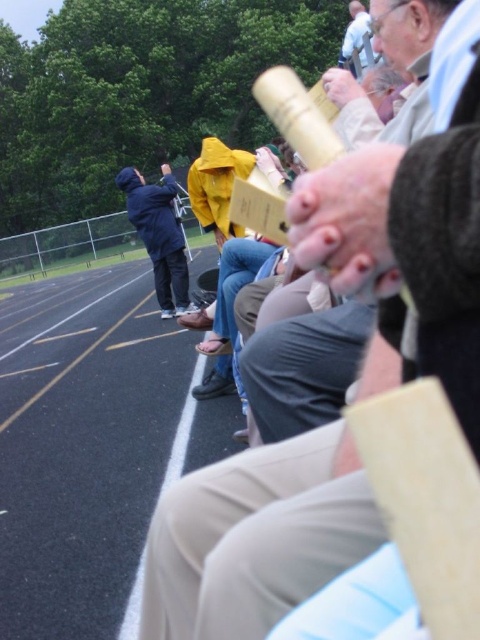
Does point (357, 237) come farther from viewer compared to point (181, 240)?

No, (357, 237) is closer to viewer.

Consider the image. Does yellow matte raincoat at center have a lesser height compared to blue matte jacket at center?

No.

Does point (207, 564) come farther from viewer compared to point (182, 291)?

No, it is not.

This screenshot has height=640, width=480. I want to click on yellow matte raincoat at center, so click(x=409, y=237).

Can you confirm if wooden telescope at center is positioned to the right of light blue shirt at upper center?

No, wooden telescope at center is not to the right of light blue shirt at upper center.

In order to click on wooden telescope at center in this screenshot , I will do pyautogui.click(x=303, y=369).

What are the coordinates of `wooden telescope at center` in the screenshot? It's located at (303, 369).

Which of these two, yellow matte raincoat at center or light blue shirt at upper center, stands shorter?

yellow matte raincoat at center

Is point (283, 580) positioned before point (352, 20)?

Yes, it is.

Where is `yellow matte raincoat at center`? The height and width of the screenshot is (640, 480). yellow matte raincoat at center is located at coordinates (409, 237).